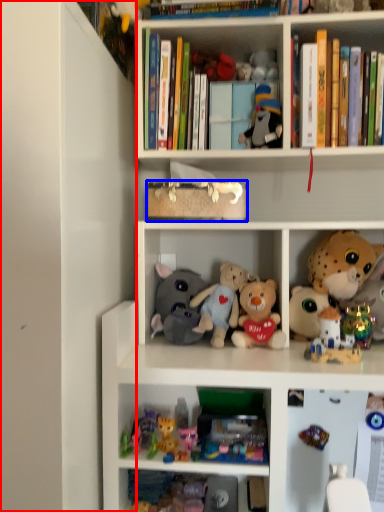
Question: Which object appears closest to the camera in this image, side (highlighted by a red box) or book (highlighted by a blue box)?

Choices:
 (A) side
 (B) book

Answer: (A)